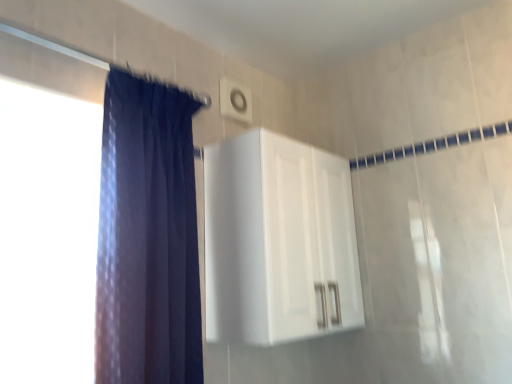
Question: Does white plastic light switch at upper center have a larger size compared to dark blue fabric at left?

Choices:
 (A) yes
 (B) no

Answer: (B)

Question: Does white plastic light switch at upper center come in front of dark blue fabric at left?

Choices:
 (A) no
 (B) yes

Answer: (A)

Question: Does white plastic light switch at upper center have a greater width compared to dark blue fabric at left?

Choices:
 (A) no
 (B) yes

Answer: (A)

Question: Is white plastic light switch at upper center surrounding dark blue fabric at left?

Choices:
 (A) yes
 (B) no

Answer: (B)

Question: From the image's perspective, is white plastic light switch at upper center over dark blue fabric at left?

Choices:
 (A) no
 (B) yes

Answer: (B)

Question: In terms of height, does dark blue fabric at left look taller or shorter compared to white glossy cabinet at upper center?

Choices:
 (A) tall
 (B) short

Answer: (A)

Question: Is dark blue fabric at left in front of or behind white glossy cabinet at upper center in the image?

Choices:
 (A) front
 (B) behind

Answer: (A)

Question: Looking at their shapes, would you say dark blue fabric at left is wider or thinner than white glossy cabinet at upper center?

Choices:
 (A) wide
 (B) thin

Answer: (B)

Question: Is dark blue fabric at left situated inside white glossy cabinet at upper center or outside?

Choices:
 (A) inside
 (B) outside

Answer: (B)

Question: From a real-world perspective, relative to white plastic light switch at upper center, is white glossy cabinet at upper center vertically above or below?

Choices:
 (A) above
 (B) below

Answer: (B)

Question: Is white glossy cabinet at upper center wider or thinner than white plastic light switch at upper center?

Choices:
 (A) thin
 (B) wide

Answer: (B)

Question: Considering the relative positions of white glossy cabinet at upper center and white plastic light switch at upper center in the image provided, is white glossy cabinet at upper center to the left or to the right of white plastic light switch at upper center?

Choices:
 (A) left
 (B) right

Answer: (B)

Question: Does point (272, 331) appear closer or farther from the camera than point (244, 110)?

Choices:
 (A) farther
 (B) closer

Answer: (B)

Question: Relative to dark blue fabric at left, is white glossy cabinet at upper center in front or behind?

Choices:
 (A) behind
 (B) front

Answer: (A)

Question: From the image's perspective, is white glossy cabinet at upper center above or below dark blue fabric at left?

Choices:
 (A) above
 (B) below

Answer: (B)